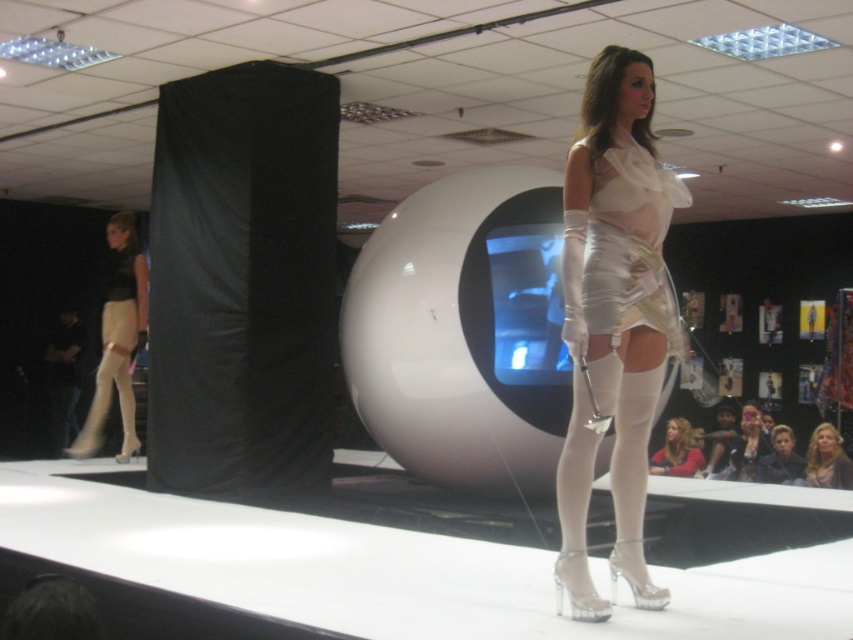
You are a photographer at the fashion show. You want to capture a photo of the matte white stockings at left and the matte white dress at center without any obstruction. Based on the scene, can you position yourself so both are visible clearly?

The matte white stockings at left is in front of the matte white dress at center, so positioning yourself at an angle where both can be seen without one blocking the other would be possible by moving to the side opposite of the obstruction.

You are a photographer at the fashion show. You need to capture a clear shot of the metallic silver dress at center and the blonde hair at center. Which object should you focus on first to ensure it appears larger in the photo?

The metallic silver dress at center is much taller than the blonde hair at center, so you should focus on the metallic silver dress at center first to ensure it appears larger in the photo.

You are a photographer at the fashion show. You need to capture a photo where the metallic silver dress at center and the blonde hair at center are both visible. Based on their positions, which one should you focus on first to ensure both are in frame?

The metallic silver dress at center is positioned on the left side of blonde hair at center, so you should focus on the blonde hair at center first to ensure both are in frame.